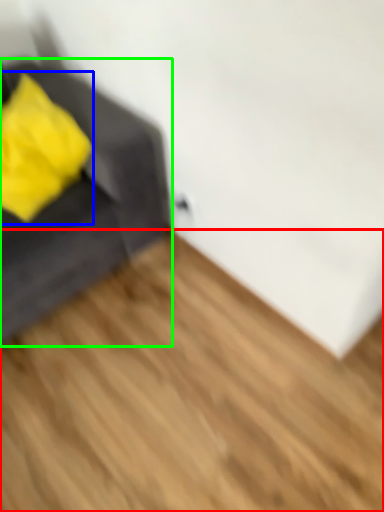
Question: Considering the real-world distances, which object is closest to hardwood (highlighted by a red box)? throw pillow (highlighted by a blue box) or furniture (highlighted by a green box).

Choices:
 (A) throw pillow
 (B) furniture

Answer: (B)